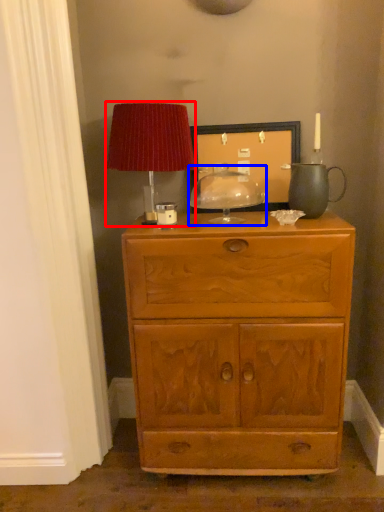
Question: Which of the following is the farthest to the observer, table lamp (highlighted by a red box) or candle holder (highlighted by a blue box)?

Choices:
 (A) table lamp
 (B) candle holder

Answer: (B)